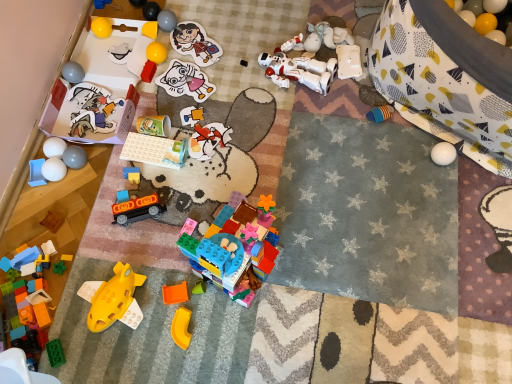
Image resolution: width=512 pixels, height=384 pixels. I want to click on vacant space that is in between matte paper sticker at center, the nineteenth toy when ordered from left to right, and matte gray ball at upper center, which is the 18th toy in left-to-right order, so click(x=180, y=56).